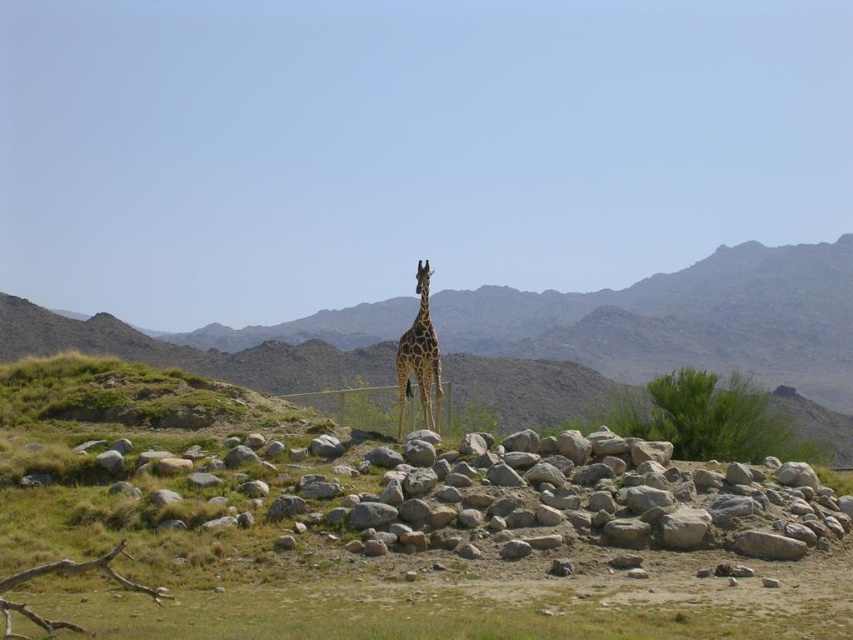
You are a photographer trying to capture the spotted fur giraffe at center. However, there is a brown rocky mountain at center blocking your view. Can you adjust your position to see the giraffe without moving it?

The spotted fur giraffe at center is behind the brown rocky mountain at center, so you can move to the side of the mountain to get a clear view of the giraffe.

You are a hiker trying to reach the brown rocky mountain at center from the spotted fur giraffe at center. Which direction should you head?

You should head to the left to reach the brown rocky mountain at center from the spotted fur giraffe at center because the brown rocky mountain at center is located to the left of the spotted fur giraffe at center.